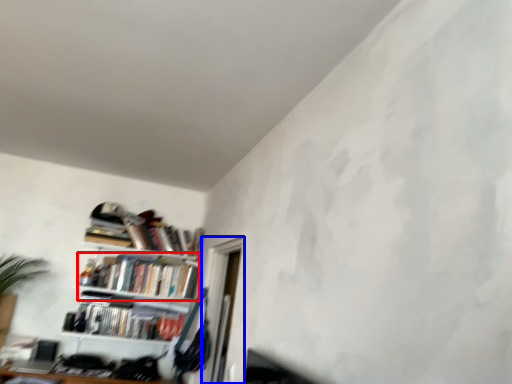
Question: Which object is further to the camera taking this photo, book (highlighted by a red box) or window (highlighted by a blue box)?

Choices:
 (A) book
 (B) window

Answer: (A)